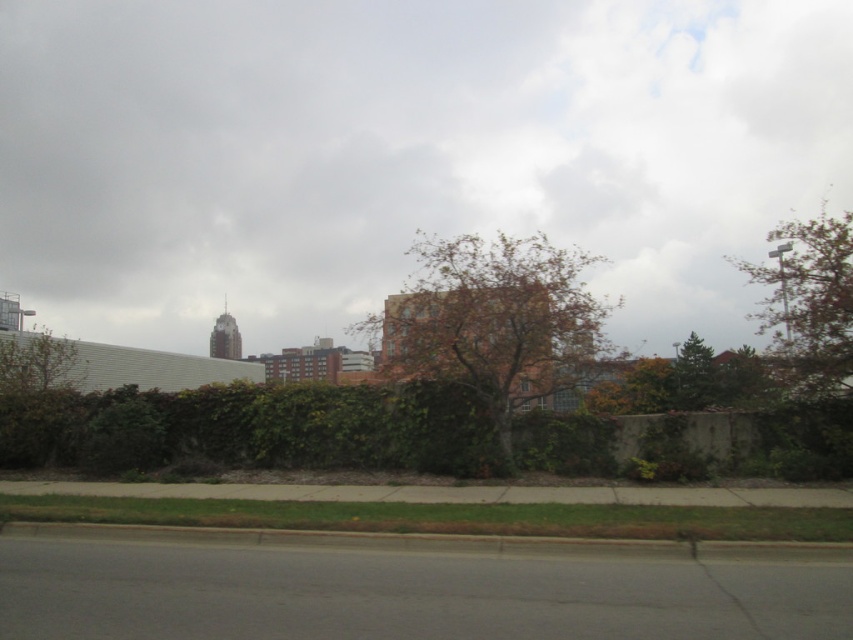
You are standing at the point closer to the camera between the two points, point (427, 438) and point (495, 374). Which point are you standing at?

You are standing at point (427, 438) because it is further to the camera than point (495, 374).

You are standing in the urban landscape and looking towards the green leafy hedge at lower center. Which direction should you look to see the cloudy sky at upper center?

The cloudy sky at upper center is to the left of the green leafy hedge at lower center, so you should look to your left to see it.

You are a drone operator planning to fly a drone from the ground level to capture aerial shots of the brown textured tree at center and the cloudy sky at upper center. Based on the scene, which object will the drone encounter first as it ascends vertically from the ground?

The drone will first encounter the brown textured tree at center before reaching the cloudy sky at upper center because the brown textured tree at center is positioned behind the cloudy sky at upper center, meaning it is closer to the drone when ascending from the ground.